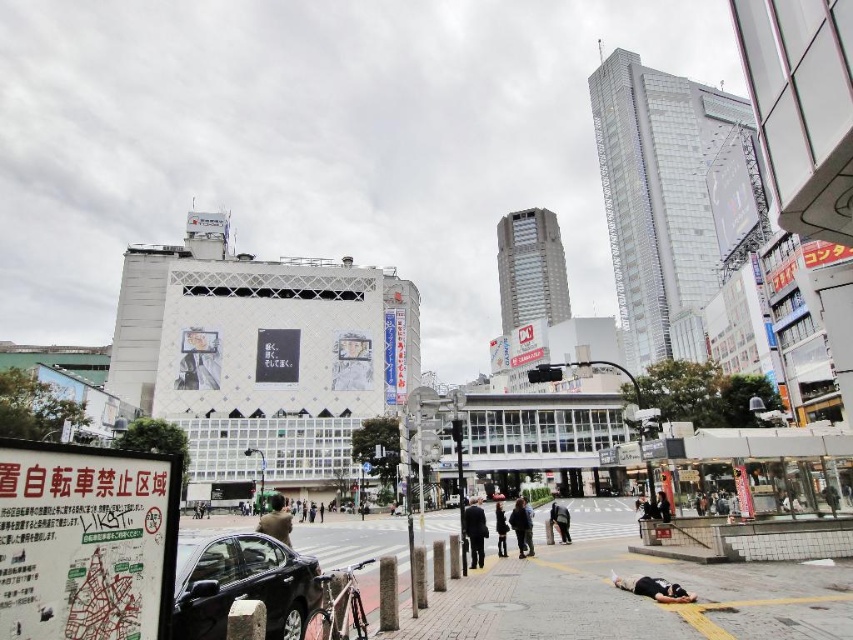
Between point (190, 600) and point (479, 532), which one is positioned in front?

Point (190, 600) is in front.

Can you confirm if shiny black sedan at lower left is positioned to the right of dark gray suit at center?

In fact, shiny black sedan at lower left is to the left of dark gray suit at center.

Is point (190, 582) positioned in front of point (474, 563)?

Yes, point (190, 582) is closer to viewer.

At what (x,y) coordinates should I click in order to perform the action: click on shiny black sedan at lower left. Please return your answer as a coordinate pair (x, y). The height and width of the screenshot is (640, 853). Looking at the image, I should click on (241, 584).

Is shiny black sedan at lower left shorter than dark gray fabric coat at center?

Indeed, shiny black sedan at lower left has a lesser height compared to dark gray fabric coat at center.

Does shiny black sedan at lower left have a greater width compared to dark gray fabric coat at center?

In fact, shiny black sedan at lower left might be narrower than dark gray fabric coat at center.

This screenshot has height=640, width=853. What do you see at coordinates (241, 584) in the screenshot?
I see `shiny black sedan at lower left` at bounding box center [241, 584].

Image resolution: width=853 pixels, height=640 pixels. I want to click on shiny black sedan at lower left, so click(x=241, y=584).

Between dark gray suit at center and dark gray fabric coat at center, which one has less height?

Standing shorter between the two is dark gray fabric coat at center.

Can you confirm if dark gray suit at center is positioned below dark gray fabric coat at center?

Indeed, dark gray suit at center is positioned under dark gray fabric coat at center.

Who is more forward, (480,540) or (521,506)?

Point (480,540) is in front.

I want to click on dark gray suit at center, so click(x=474, y=531).